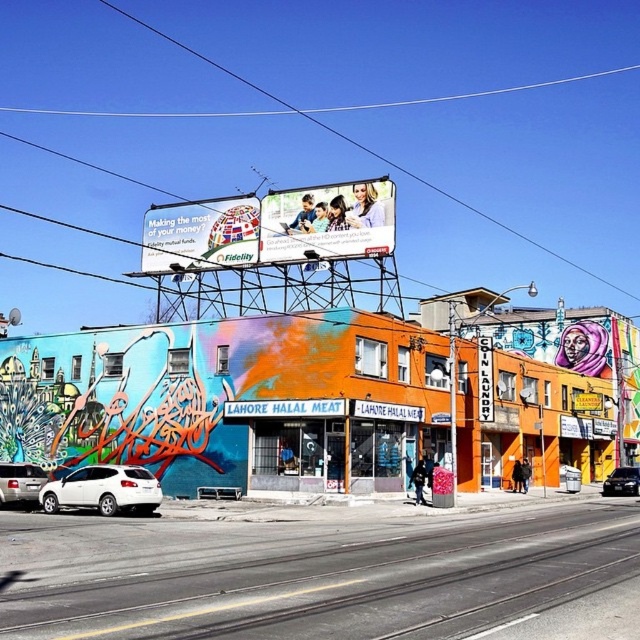
You are a delivery driver who needs to park your truck next to the silver metallic sedan at lower left and the orange painted sign at center. Since your truck is 6 meters long, will there be enough space between them to park?

The silver metallic sedan at lower left is larger in size than the orange painted sign at center, but the description does not provide specific measurements of the distance between them. Therefore, it is impossible to determine if there is enough space for the truck to park between them.

You are standing in front of the colorful building with the mural. There are two points marked on the building. One is at coordinates point (376, 244) and the other is at point (61, 506). Which point is closer to you?

Point (61, 506) is closer to you because it is less further to the camera than point (376, 244).

You are a delivery driver who needs to park your 2.5 meter wide van between the silver metallic sedan at lower left and the black glossy sedan at center. Can you fit your van there?

The silver metallic sedan at lower left has a lesser width compared to black glossy sedan at center. Therefore, the space between them may be sufficient for your 2.5 meter wide van, but you should check the exact distance between the two vehicles to ensure it accommodates your vehicle.